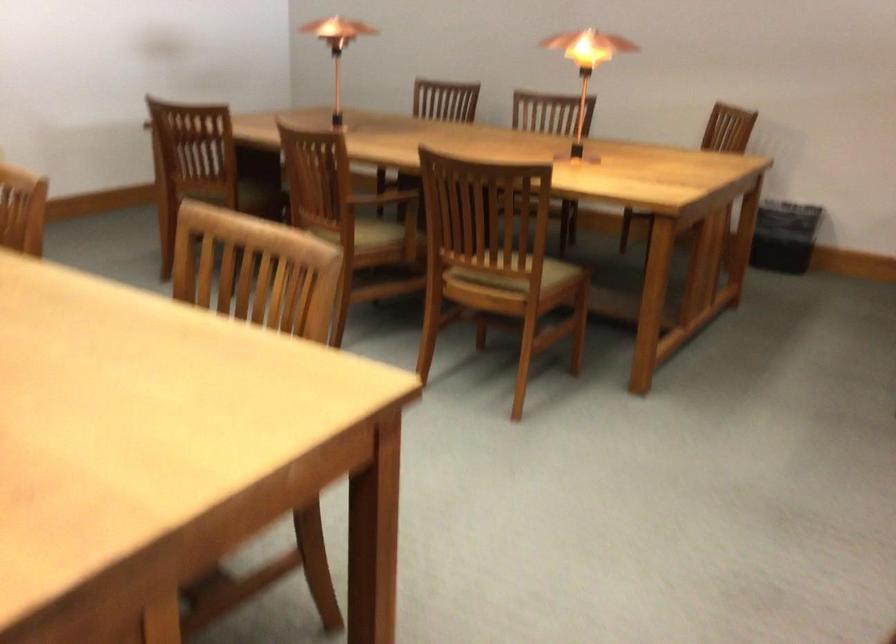
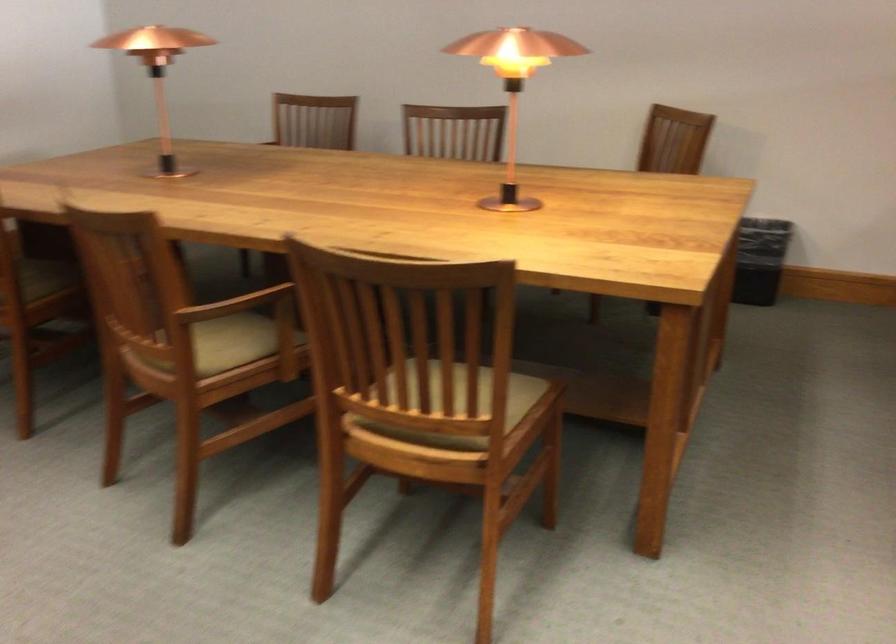
Question: The images are taken continuously from a first-person perspective. In which direction are you moving?

Choices:
 (A) Left
 (B) Right
 (C) Forward
 (D) Backward

Answer: (C)